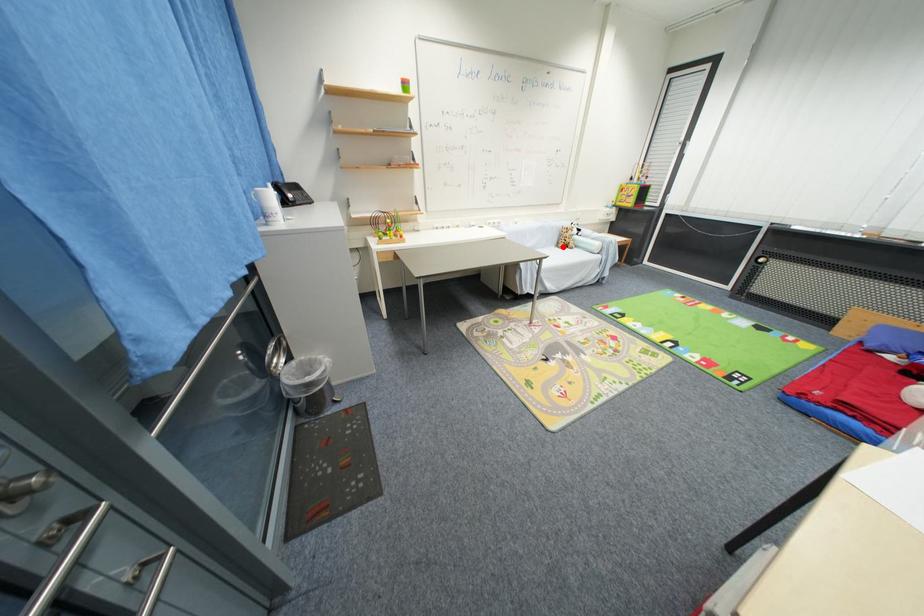
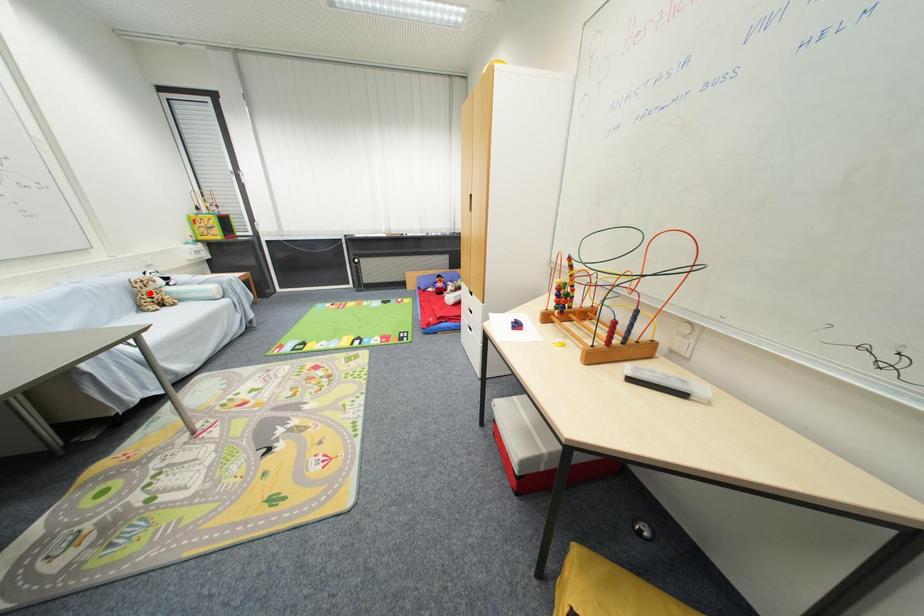
I am providing you with two images of the same scene from different viewpoints. A red point is marked on the first image and another point is marked on the second image. Is the red point in image1 aligned with the point shown in image2?

No